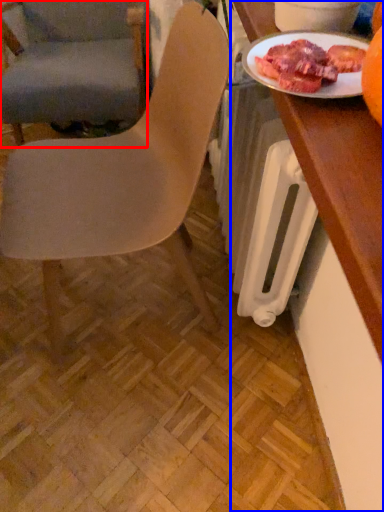
Question: Among these objects, which one is nearest to the camera, chair (highlighted by a red box) or desk (highlighted by a blue box)?

Choices:
 (A) chair
 (B) desk

Answer: (B)